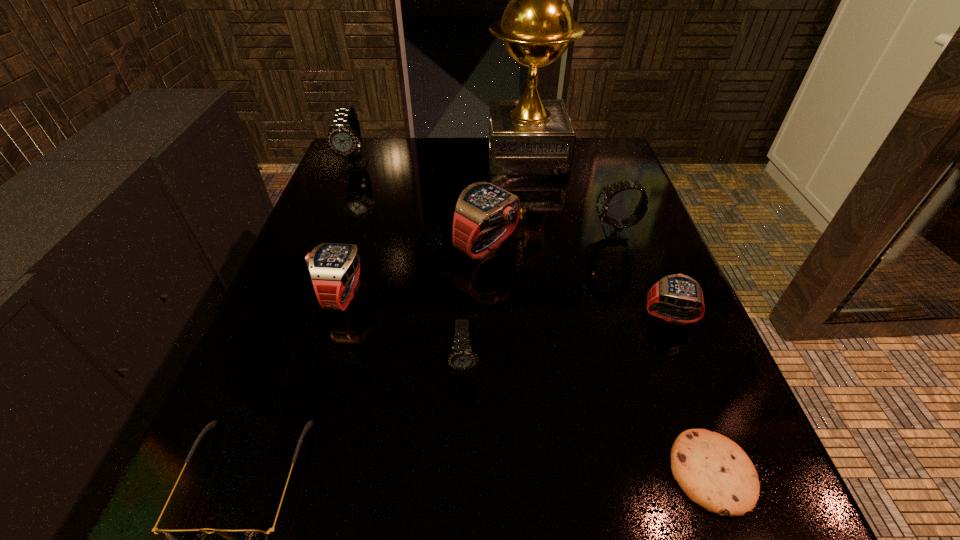
The height and width of the screenshot is (540, 960). What are the coordinates of `the fourth closest watch to the smallest gray watch` in the screenshot? It's located at (616, 229).

Identify the location of watch object that ranks as the second closest to the leftmost red watch. The image size is (960, 540). (461, 358).

Where is `gray watch that is the nearest to the rightmost red watch`? The image size is (960, 540). gray watch that is the nearest to the rightmost red watch is located at coordinates (616, 229).

What are the coordinates of `the third closest gray watch to the leftmost red watch` in the screenshot? It's located at pyautogui.click(x=616, y=229).

The height and width of the screenshot is (540, 960). Identify the location of red watch that stands as the second closest to the second smallest gray watch. (677, 290).

Choose which red watch is the third nearest neighbor to the tallest object. Please provide its 2D coordinates. Your answer should be formatted as a tuple, i.e. [(x, y)], where the tuple contains the x and y coordinates of a point satisfying the conditions above.

[(677, 290)]

You are a GUI agent. You are given a task and a screenshot of the screen. Output one action in this format:
    pyautogui.click(x=<x>, y=<y>)
    Task: Click on the free spot that satisfies the following two spatial constraints: 1. on the front-facing side of the tallest object; 2. on the face of the farthest gray watch
    The width and height of the screenshot is (960, 540).
    Given the screenshot: What is the action you would take?
    pyautogui.click(x=529, y=166)

I want to click on free spot that satisfies the following two spatial constraints: 1. on the face of the second smallest red watch; 2. on the left side of the farthest watch, so click(x=304, y=295).

Image resolution: width=960 pixels, height=540 pixels. Find the location of `free location that satisfies the following two spatial constraints: 1. on the face of the eighth shortest object; 2. on the right side of the second biggest red watch`. free location that satisfies the following two spatial constraints: 1. on the face of the eighth shortest object; 2. on the right side of the second biggest red watch is located at coordinates (304, 295).

At what (x,y) coordinates should I click in order to perform the action: click on free location that satisfies the following two spatial constraints: 1. on the face of the rightmost gray watch; 2. on the back side of the shortest object. Please return your answer as a coordinate pair (x, y). The image size is (960, 540). Looking at the image, I should click on (700, 472).